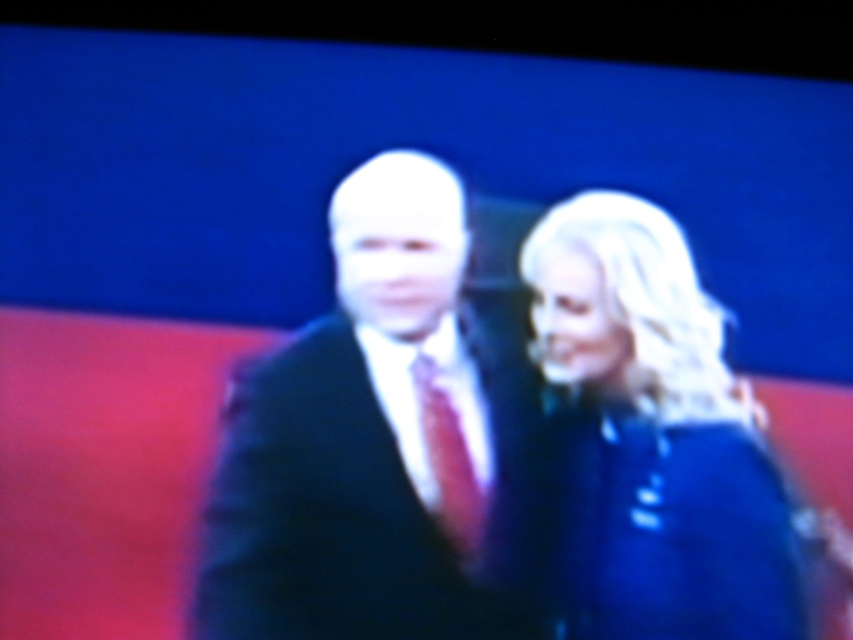
Question: Which point is closer to the camera?

Choices:
 (A) shiny blue coat at right
 (B) matte black suit at center
 (C) shiny red tie at center

Answer: (A)

Question: Does shiny blue coat at right have a lesser width compared to shiny red tie at center?

Choices:
 (A) no
 (B) yes

Answer: (A)

Question: Where is matte black suit at center located in relation to shiny red tie at center in the image?

Choices:
 (A) above
 (B) below

Answer: (A)

Question: Which of these objects is positioned farthest from the shiny blue coat at right?

Choices:
 (A) matte black suit at center
 (B) shiny red tie at center

Answer: (B)

Question: Does matte black suit at center appear on the right side of shiny red tie at center?

Choices:
 (A) yes
 (B) no

Answer: (B)

Question: Which object is the closest to the matte black suit at center?

Choices:
 (A) shiny blue coat at right
 (B) shiny red tie at center

Answer: (B)